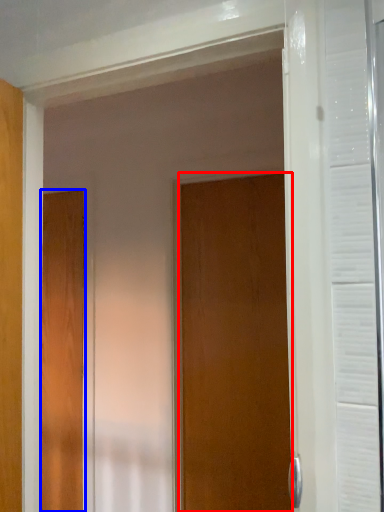
Question: Which point is closer to the camera, door (highlighted by a red box) or door (highlighted by a blue box)?

Choices:
 (A) door
 (B) door

Answer: (A)